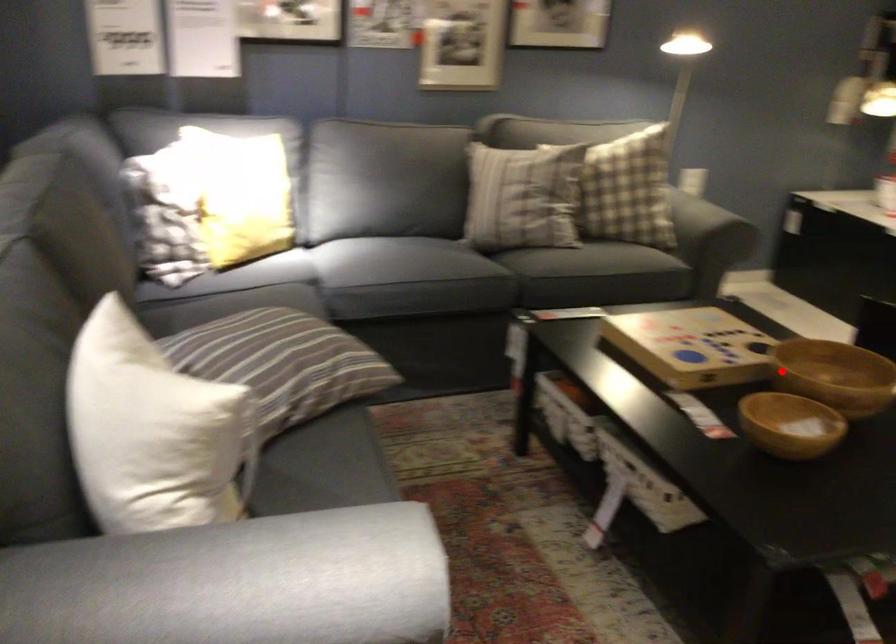
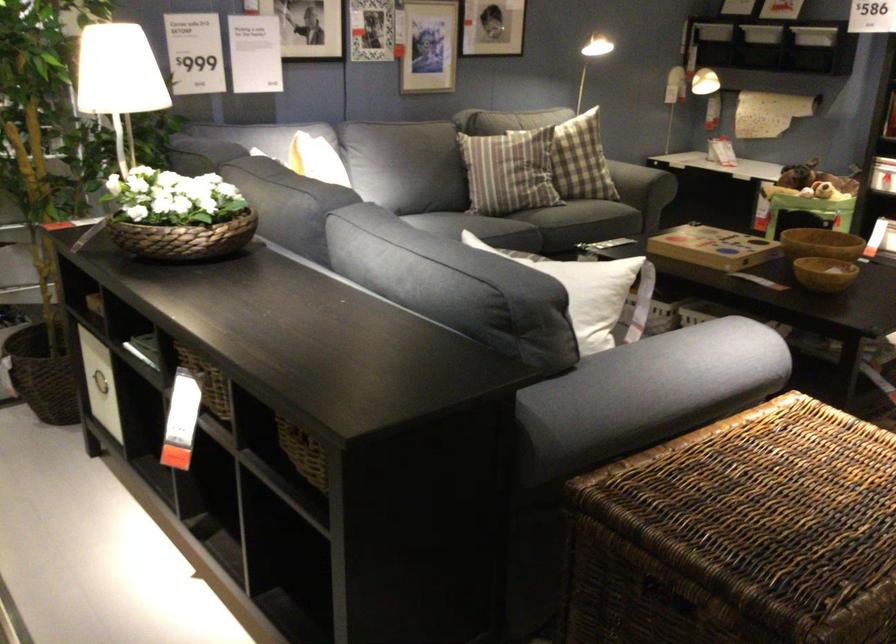
Where in the second image is the point corresponding to the highlighted location from the first image?

(821, 243)